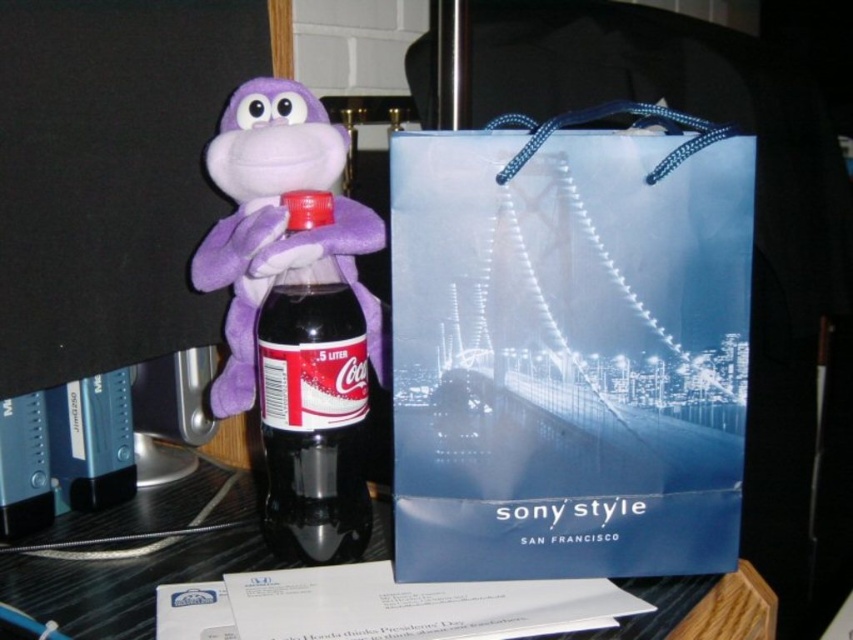
What do you see at coordinates (312, 416) in the screenshot?
I see `matte plastic bottle at center` at bounding box center [312, 416].

Can you confirm if matte plastic bottle at center is shorter than purple plush monkey at center?

Correct, matte plastic bottle at center is not as tall as purple plush monkey at center.

Describe the element at coordinates (312, 416) in the screenshot. I see `matte plastic bottle at center` at that location.

Image resolution: width=853 pixels, height=640 pixels. Identify the location of matte plastic bottle at center. (312, 416).

Does blue paper bag at center have a smaller size compared to matte plastic bottle at center?

No.

Is point (575, 368) in front of point (268, 394)?

That is True.

Locate an element on the screen. This screenshot has width=853, height=640. blue paper bag at center is located at coordinates (569, 346).

Can you confirm if blue paper bag at center is taller than purple plush monkey at center?

Indeed, blue paper bag at center has a greater height compared to purple plush monkey at center.

Between point (556, 340) and point (239, 330), which one is positioned behind?

The point (239, 330) is more distant.

This screenshot has width=853, height=640. I want to click on blue paper bag at center, so click(x=569, y=346).